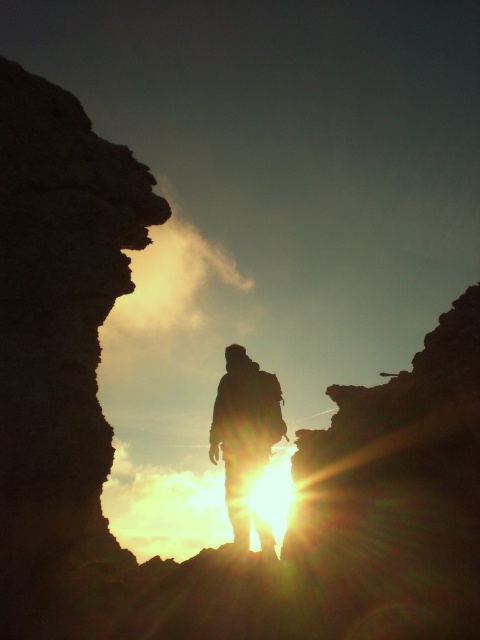
Question: Among these points, which one is nearest to the camera?

Choices:
 (A) (254, 438)
 (B) (103, 216)

Answer: (B)

Question: Among these objects, which one is farthest from the camera?

Choices:
 (A) rugged stone cliff at left
 (B) silhouette backpack at center

Answer: (B)

Question: Is rugged stone cliff at left bigger than silhouette backpack at center?

Choices:
 (A) no
 (B) yes

Answer: (B)

Question: Can you confirm if rugged stone cliff at left is positioned to the left of silhouette backpack at center?

Choices:
 (A) yes
 (B) no

Answer: (A)

Question: Considering the relative positions of rugged stone cliff at left and silhouette backpack at center in the image provided, where is rugged stone cliff at left located with respect to silhouette backpack at center?

Choices:
 (A) right
 (B) left

Answer: (B)